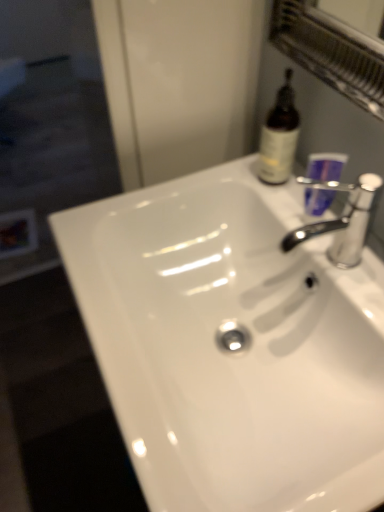
Find the location of a particular element. The width and height of the screenshot is (384, 512). free space to the left of purple plastic cup at upper right is located at coordinates (244, 188).